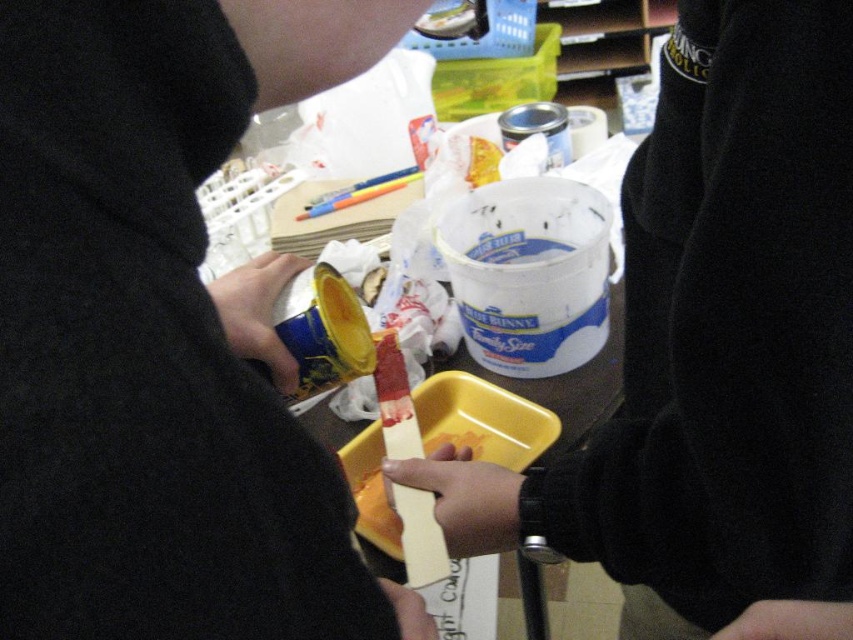
Question: Where is metallic blue can at center located in relation to yellow plastic tray at center in the image?

Choices:
 (A) right
 (B) left

Answer: (B)

Question: Observing the image, what is the correct spatial positioning of metallic blue can at center in reference to yellow plastic tray at center?

Choices:
 (A) below
 (B) above

Answer: (B)

Question: Which point is closer to the camera?

Choices:
 (A) metallic blue can at center
 (B) yellow plastic tray at center

Answer: (A)

Question: Which point appears farthest from the camera in this image?

Choices:
 (A) (120, 44)
 (B) (759, 86)

Answer: (B)

Question: Is metallic blue can at center above yellow plastic tray at center?

Choices:
 (A) no
 (B) yes

Answer: (B)